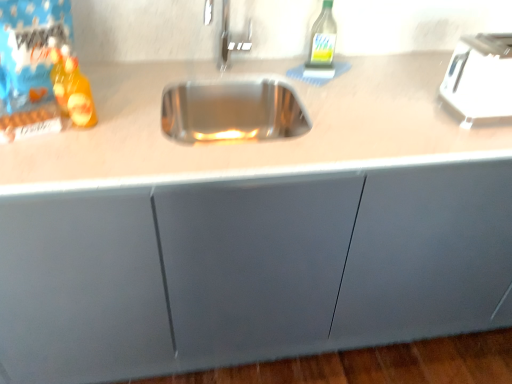
How much space does green glass bottle at upper right, which is the first bottle in back-to-front order, occupy vertically?

green glass bottle at upper right, which is the first bottle in back-to-front order, is 8.10 inches tall.

The height and width of the screenshot is (384, 512). Describe the element at coordinates (72, 90) in the screenshot. I see `translucent plastic bottle at left, marked as the first bottle in a bottom-to-top arrangement` at that location.

Image resolution: width=512 pixels, height=384 pixels. I want to click on green glass bottle at upper right, which appears as the second bottle when ordered from the bottom, so point(322,40).

Is green glass bottle at upper right, which is the 1th bottle in right-to-left order, oriented away from white plastic toaster at upper right?

No, white plastic toaster at upper right is not at the back of green glass bottle at upper right, which is the 1th bottle in right-to-left order.

Locate an element on the screen. The width and height of the screenshot is (512, 384). the 1st bottle to the left of the white plastic toaster at upper right, starting your count from the anchor is located at coordinates [x=322, y=40].

Can you confirm if green glass bottle at upper right, which ranks as the second bottle in front-to-back order, is positioned to the right of white plastic toaster at upper right?

No.

What's the angular difference between green glass bottle at upper right, which ranks as the second bottle in front-to-back order, and white plastic toaster at upper right's facing directions?

They differ by 6.84 degrees in their facing directions.

Considering the positions of objects translucent plastic bottle at left, which is the 1th bottle from left to right, and green glass bottle at upper right, which appears as the second bottle when ordered from the bottom, in the image provided, who is behind, translucent plastic bottle at left, which is the 1th bottle from left to right, or green glass bottle at upper right, which appears as the second bottle when ordered from the bottom,?

green glass bottle at upper right, which appears as the second bottle when ordered from the bottom.

Which object is thinner, translucent plastic bottle at left, marked as the first bottle in a front-to-back arrangement, or green glass bottle at upper right, which appears as the second bottle when ordered from the bottom?

translucent plastic bottle at left, marked as the first bottle in a front-to-back arrangement.

Considering the sizes of objects translucent plastic bottle at left, which is the 1th bottle from left to right, and green glass bottle at upper right, which is the 1th bottle in right-to-left order, in the image provided, who is bigger, translucent plastic bottle at left, which is the 1th bottle from left to right, or green glass bottle at upper right, which is the 1th bottle in right-to-left order,?

With larger size is green glass bottle at upper right, which is the 1th bottle in right-to-left order.

Which is less distant, (482, 106) or (321, 43)?

The point (482, 106) is closer.

Would you say white plastic toaster at upper right is outside green glass bottle at upper right, which is the first bottle in back-to-front order?

white plastic toaster at upper right lies outside green glass bottle at upper right, which is the first bottle in back-to-front order,'s area.

This screenshot has width=512, height=384. In order to click on the 1st bottle to the left of the white plastic toaster at upper right, counting from the anchor's position in this screenshot , I will do `click(322, 40)`.

From the image's perspective, which object appears higher, white plastic toaster at upper right or green glass bottle at upper right, which is the 1th bottle in right-to-left order?

From the image's view, green glass bottle at upper right, which is the 1th bottle in right-to-left order, is above.

From the image's perspective, is green glass bottle at upper right, which ranks as the second bottle in front-to-back order, located above or below translucent plastic bottle at left, the 2th bottle from the right?

green glass bottle at upper right, which ranks as the second bottle in front-to-back order, is above translucent plastic bottle at left, the 2th bottle from the right.

Based on the photo, can you confirm if green glass bottle at upper right, which is the 1th bottle in right-to-left order, is positioned to the right of translucent plastic bottle at left, which is the 1th bottle from left to right?

Yes.

Which is farther, (317, 64) or (83, 105)?

Positioned behind is point (317, 64).

Which is behind, white plastic toaster at upper right or translucent plastic bottle at left, the second bottle from the back?

Positioned behind is white plastic toaster at upper right.

Is white plastic toaster at upper right facing away from translucent plastic bottle at left, marked as the first bottle in a front-to-back arrangement?

white plastic toaster at upper right does not have its back to translucent plastic bottle at left, marked as the first bottle in a front-to-back arrangement.

Can you confirm if white plastic toaster at upper right is positioned to the right of translucent plastic bottle at left, which is the 1th bottle from left to right?

Yes, white plastic toaster at upper right is to the right of translucent plastic bottle at left, which is the 1th bottle from left to right.

This screenshot has height=384, width=512. I want to click on appliance above the translucent plastic bottle at left, the 2th bottle from the right (from the image's perspective), so click(480, 77).

Between translucent plastic bottle at left, the second bottle from the back, and white plastic toaster at upper right, which one has less height?

Standing shorter between the two is white plastic toaster at upper right.

Considering the positions of objects translucent plastic bottle at left, the second bottle from the back, and white plastic toaster at upper right in the image provided, who is more to the left, translucent plastic bottle at left, the second bottle from the back, or white plastic toaster at upper right?

translucent plastic bottle at left, the second bottle from the back.

I want to click on appliance that is under the green glass bottle at upper right, which ranks as the second bottle in front-to-back order (from a real-world perspective), so click(480, 77).

Where is `bottle behind the translucent plastic bottle at left, which is the 1th bottle from left to right`? This screenshot has width=512, height=384. bottle behind the translucent plastic bottle at left, which is the 1th bottle from left to right is located at coordinates (322, 40).

Based on their spatial positions, is translucent plastic bottle at left, the second bottle from the back, or green glass bottle at upper right, which ranks as the 1th bottle in top-to-bottom order, closer to white plastic toaster at upper right?

green glass bottle at upper right, which ranks as the 1th bottle in top-to-bottom order, lies closer to white plastic toaster at upper right than the other object.

Looking at the image, which one is located closer to green glass bottle at upper right, which is the 1th bottle in right-to-left order, translucent plastic bottle at left, marked as the first bottle in a front-to-back arrangement, or white plastic toaster at upper right?

Among the two, white plastic toaster at upper right is located nearer to green glass bottle at upper right, which is the 1th bottle in right-to-left order.

Considering their positions, is green glass bottle at upper right, which appears as the second bottle when ordered from the bottom, positioned closer to white plastic toaster at upper right than translucent plastic bottle at left, marked as the first bottle in a front-to-back arrangement?

Among the two, green glass bottle at upper right, which appears as the second bottle when ordered from the bottom, is located nearer to white plastic toaster at upper right.

When comparing their distances from translucent plastic bottle at left, the second bottle from the back, does white plastic toaster at upper right or green glass bottle at upper right, which ranks as the second bottle in front-to-back order, seem further?

The object further to translucent plastic bottle at left, the second bottle from the back, is white plastic toaster at upper right.

Which object lies further to the anchor point green glass bottle at upper right, which is the 1th bottle in right-to-left order, white plastic toaster at upper right or translucent plastic bottle at left, which is the 1th bottle from left to right?

translucent plastic bottle at left, which is the 1th bottle from left to right, is further to green glass bottle at upper right, which is the 1th bottle in right-to-left order.

Estimate the real-world distances between objects in this image. Which object is closer to translucent plastic bottle at left, which is the second bottle in top-to-bottom order, green glass bottle at upper right, which is the 1th bottle in right-to-left order, or white plastic toaster at upper right?

Based on the image, green glass bottle at upper right, which is the 1th bottle in right-to-left order, appears to be nearer to translucent plastic bottle at left, which is the second bottle in top-to-bottom order.

The height and width of the screenshot is (384, 512). In order to click on bottle between translucent plastic bottle at left, which is the second bottle in top-to-bottom order, and white plastic toaster at upper right in this screenshot , I will do `click(322, 40)`.